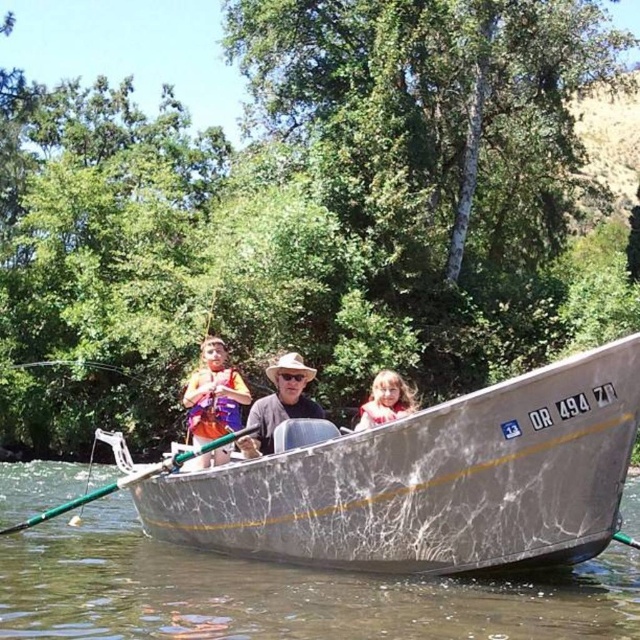
Consider the image. Does silver metallic boat at center appear on the right side of matte gray hat at center?

Yes, silver metallic boat at center is to the right of matte gray hat at center.

Is point (509, 506) closer to camera compared to point (269, 448)?

That is True.

Is point (241, 484) farther from camera compared to point (285, 372)?

No, it is in front of (285, 372).

Image resolution: width=640 pixels, height=640 pixels. I want to click on silver metallic boat at center, so click(432, 481).

Does orange life vest at center appear on the right side of light brown hair at center?

Incorrect, orange life vest at center is not on the right side of light brown hair at center.

Is point (240, 412) less distant than point (381, 380)?

No, it is not.

The height and width of the screenshot is (640, 640). Identify the location of orange life vest at center. (212, 394).

Who is shorter, matte gray hat at center or light brown hair at center?

matte gray hat at center

Which is below, matte gray hat at center or light brown hair at center?

Positioned lower is light brown hair at center.

Does point (259, 436) lie in front of point (408, 387)?

Yes.

Identify the location of matte gray hat at center. This screenshot has height=640, width=640. (280, 403).